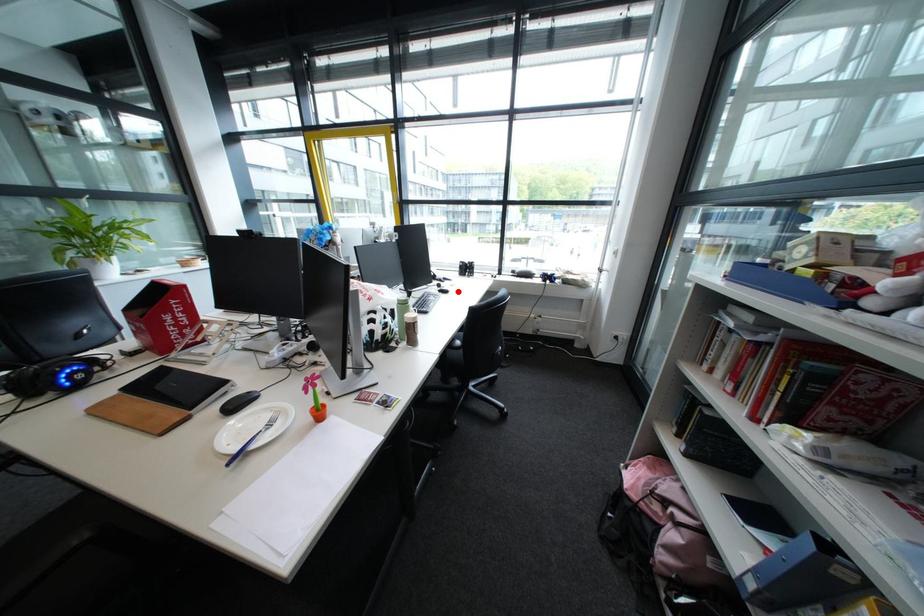
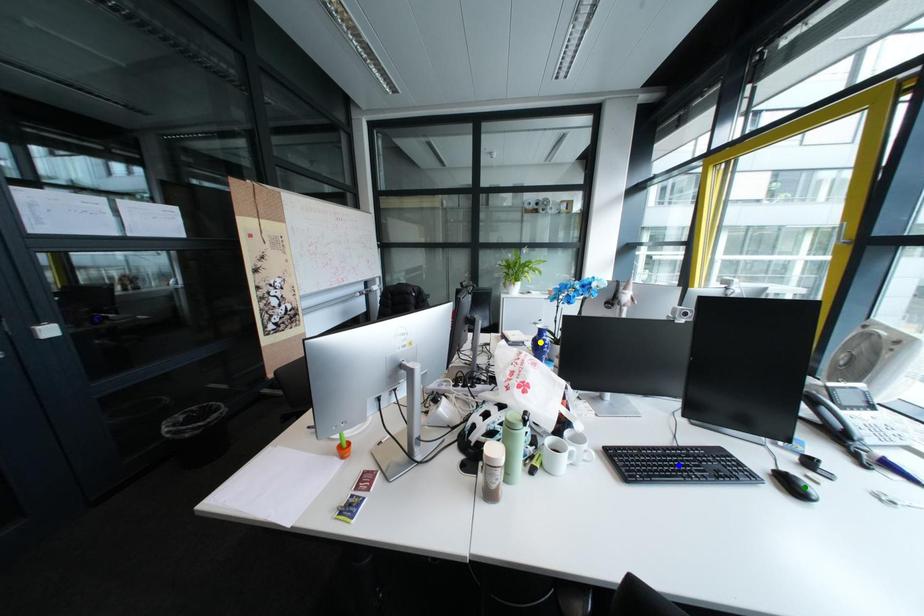
Question: I am providing you with two images of the same scene from different viewpoints. A red point is marked on the first image. You are given multiple points on the second image. Which point in image 2 represents the same 3d spot as the red point in image 1?

Choices:
 (A) green point
 (B) blue point
 (C) yellow point

Answer: (A)